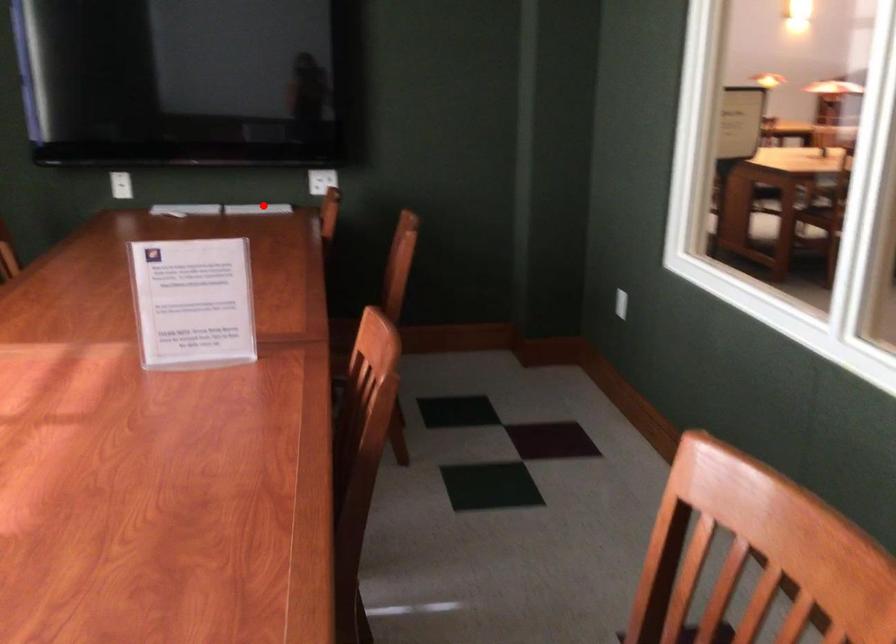
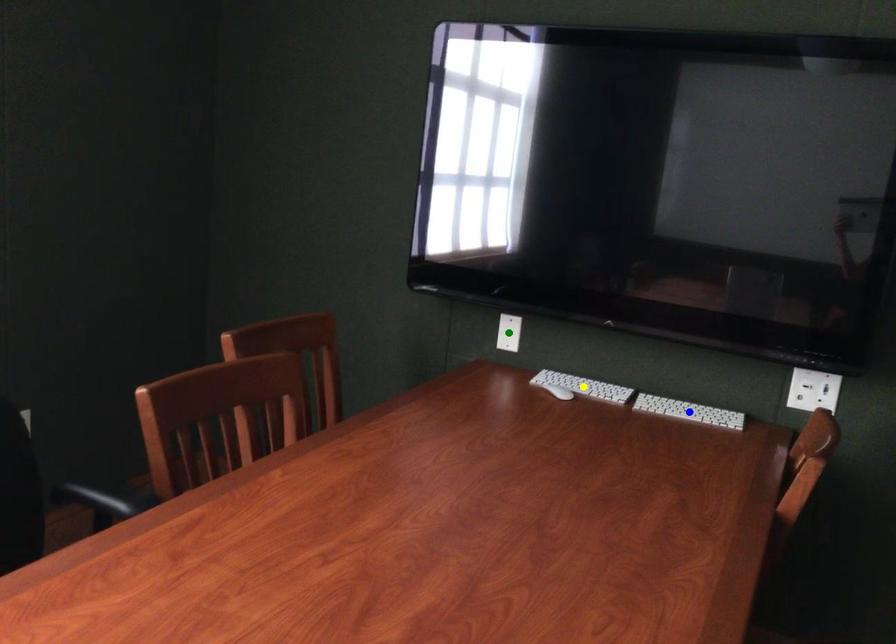
Question: I am providing you with two images of the same scene from different viewpoints. A red point is marked on the first image. You are given multiple points on the second image. In image 2, which mark is for the same physical point as the one in image 1?

Choices:
 (A) yellow point
 (B) blue point
 (C) green point

Answer: (B)